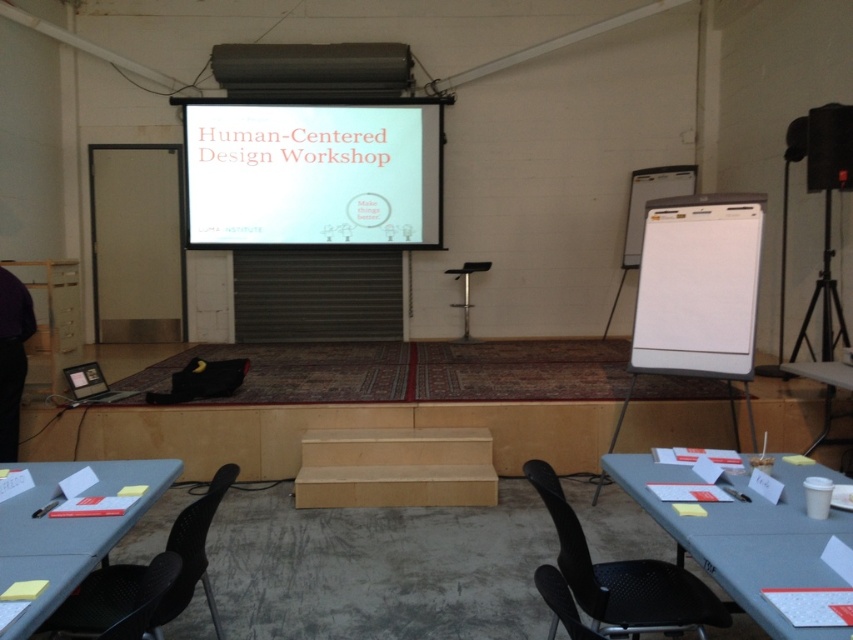
Is black mesh chair at lower right smaller than white plastic table at lower right?

Correct, black mesh chair at lower right occupies less space than white plastic table at lower right.

Does black mesh chair at lower right lie behind white plastic table at lower right?

No, it is not.

Does point (688, 577) lie in front of point (807, 365)?

Yes, point (688, 577) is in front of point (807, 365).

At what (x,y) coordinates should I click in order to perform the action: click on black mesh chair at lower right. Please return your answer as a coordinate pair (x, y). Looking at the image, I should click on (624, 579).

Is point (807, 116) farther from viewer compared to point (628, 632)?

Yes, it is behind point (628, 632).

Identify the location of black matte speaker at upper right. The image size is (853, 640). (828, 147).

Is matte gray table at lower left positioned behind black plastic projector at upper center?

No, it is not.

Between matte gray table at lower left and black plastic projector at upper center, which one has less height?

Standing shorter between the two is black plastic projector at upper center.

Is point (161, 488) closer to camera compared to point (843, 355)?

Yes, point (161, 488) is closer to viewer.

Locate an element on the screen. The image size is (853, 640). matte gray table at lower left is located at coordinates (68, 531).